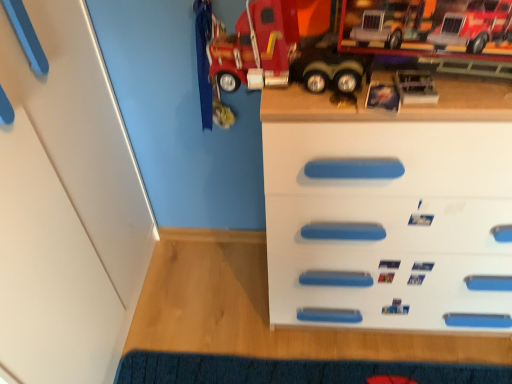
The height and width of the screenshot is (384, 512). Find the location of `free area in between white plastic chest of drawers at center and blue textured mat at lower center`. free area in between white plastic chest of drawers at center and blue textured mat at lower center is located at coordinates (223, 314).